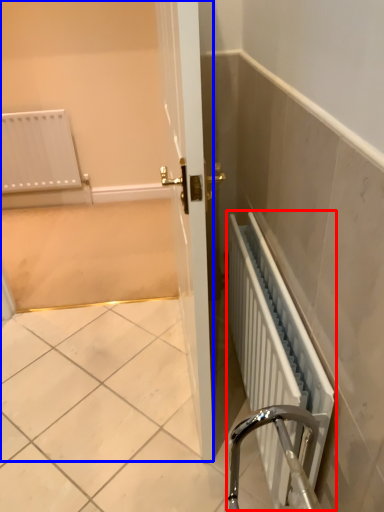
Question: Which object is closer to the camera taking this photo, radiator (highlighted by a red box) or screen door (highlighted by a blue box)?

Choices:
 (A) radiator
 (B) screen door

Answer: (A)